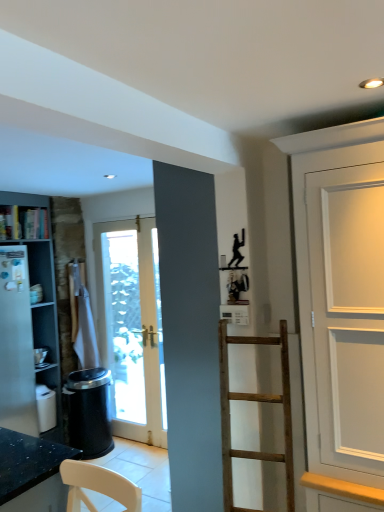
Question: In the image, is white matte cabinet at left on the left side or the right side of wooden bookshelf at left?

Choices:
 (A) left
 (B) right

Answer: (A)

Question: In terms of size, does white matte cabinet at left appear bigger or smaller than wooden bookshelf at left?

Choices:
 (A) big
 (B) small

Answer: (A)

Question: Would you say white matte cabinet at left is inside or outside wooden bookshelf at left?

Choices:
 (A) inside
 (B) outside

Answer: (B)

Question: From the image's perspective, relative to white matte cabinet at left, is wooden bookshelf at left above or below?

Choices:
 (A) below
 (B) above

Answer: (B)

Question: Considering the positions of wooden bookshelf at left and white matte cabinet at left in the image, is wooden bookshelf at left wider or thinner than white matte cabinet at left?

Choices:
 (A) wide
 (B) thin

Answer: (B)

Question: Relative to white matte cabinet at left, is wooden bookshelf at left in front or behind?

Choices:
 (A) front
 (B) behind

Answer: (B)

Question: Based on their positions, is wooden bookshelf at left located to the left or right of white matte cabinet at left?

Choices:
 (A) left
 (B) right

Answer: (B)